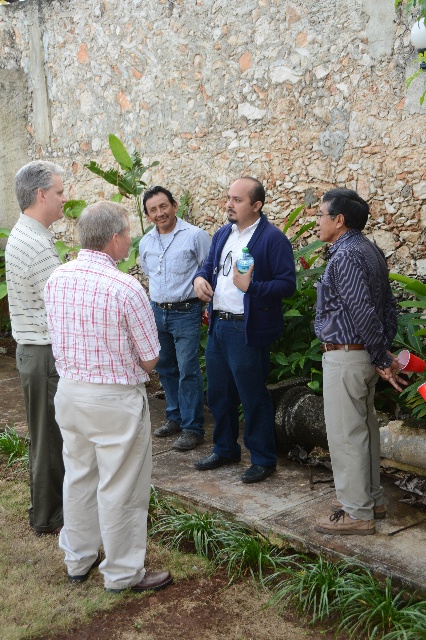
Question: Which object is positioned farthest from the green leafy plant at lower left?

Choices:
 (A) patterned fabric shirt at lower right
 (B) red checkered shirt at left
 (C) striped sweater at left
 (D) green leafy plant at right

Answer: (D)

Question: Considering the real-world distances, which object is closest to the green leafy plant at lower left?

Choices:
 (A) green leafy plant at right
 (B) white cotton shirt at left
 (C) patterned fabric shirt at lower right
 (D) blue fabric jacket at center

Answer: (D)

Question: Estimate the real-world distances between objects in this image. Which object is closer to the striped sweater at left?

Choices:
 (A) green leafy plant at lower left
 (B) green leafy plant at lower center
 (C) blue fabric jacket at center

Answer: (C)

Question: Is red checkered shirt at left thinner than green leafy plant at lower center?

Choices:
 (A) no
 (B) yes

Answer: (A)

Question: Is blue fabric jacket at center closer to the viewer compared to blue denim jeans at center?

Choices:
 (A) yes
 (B) no

Answer: (A)

Question: Does blue denim jeans at center have a lesser width compared to green leafy plant at lower left?

Choices:
 (A) no
 (B) yes

Answer: (A)